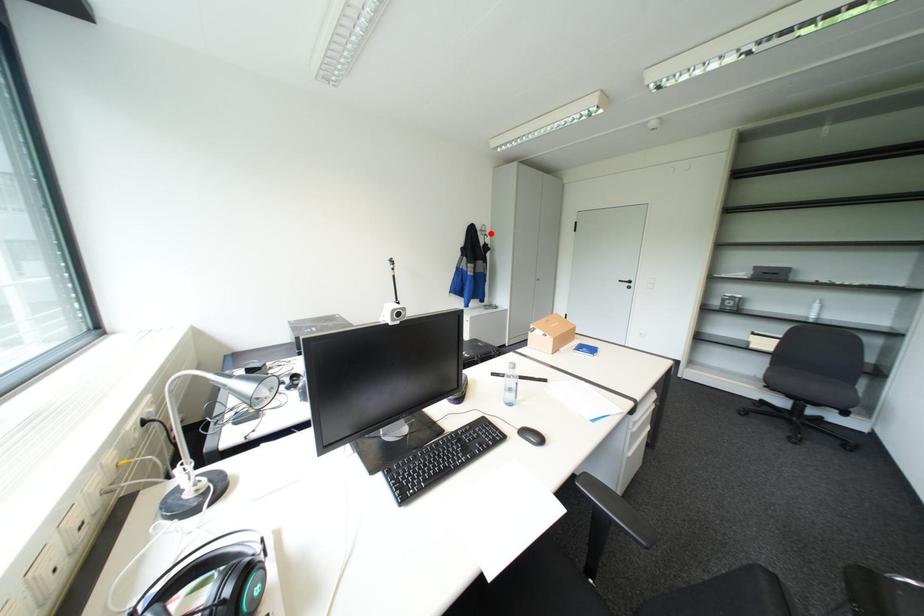
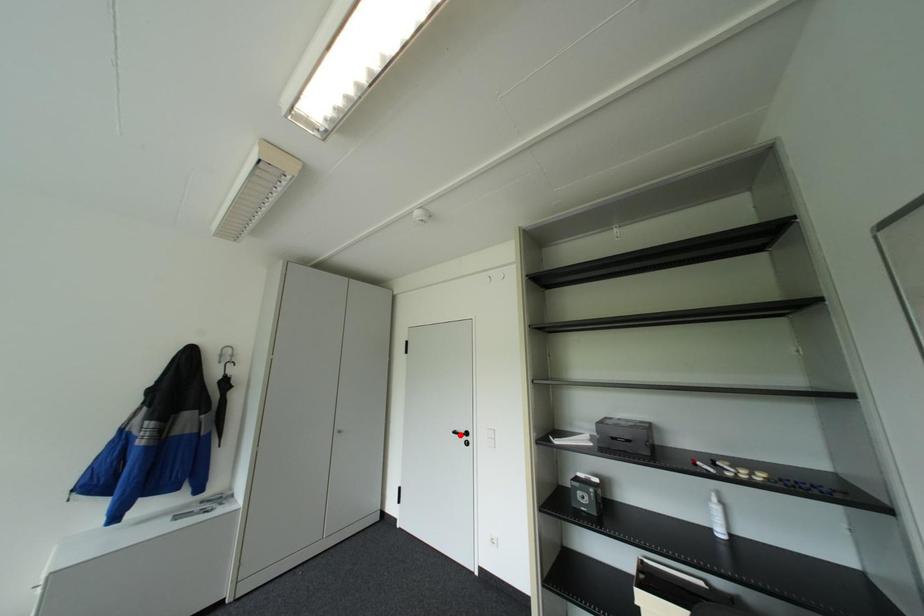
I am providing you with two images of the same scene from different viewpoints. A red point is marked on the first image and another point is marked on the second image. Is the red point in image1 aligned with the point shown in image2?

No